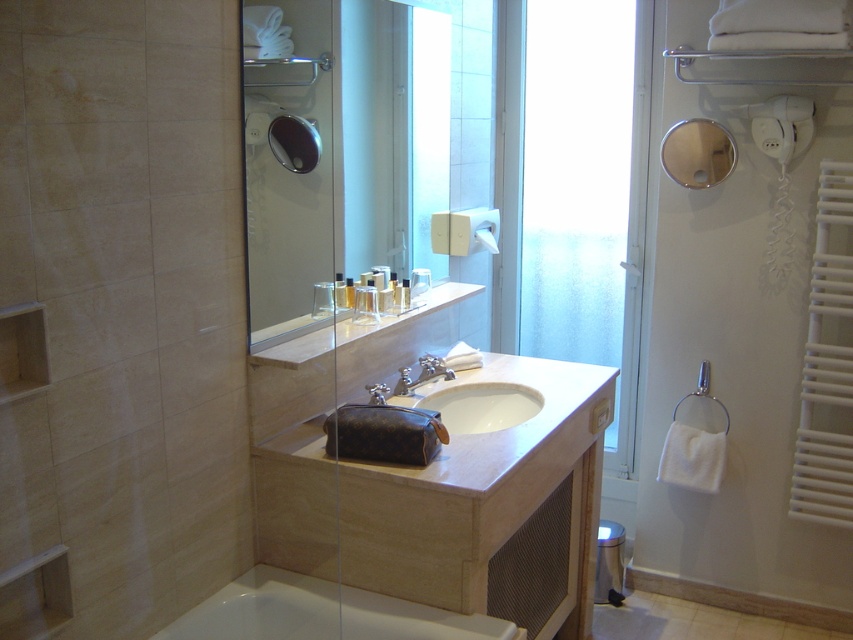
Which is in front, point (199, 621) or point (479, 241)?

Point (199, 621)

What are the coordinates of `white glossy bathtub at lower left` in the screenshot? It's located at (322, 612).

Is clear glass mirror at upper center below frosted glass door at center?

No, clear glass mirror at upper center is not below frosted glass door at center.

Is point (381, 112) positioned behind point (579, 4)?

That is False.

This screenshot has height=640, width=853. Identify the location of clear glass mirror at upper center. (323, 154).

Does white glossy bathtub at lower left come behind silver metallic faucet at sink center?

No, white glossy bathtub at lower left is in front of silver metallic faucet at sink center.

Which is in front, point (283, 595) or point (401, 369)?

Point (283, 595) is more forward.

Locate an element on the screen. The image size is (853, 640). white glossy bathtub at lower left is located at coordinates tap(322, 612).